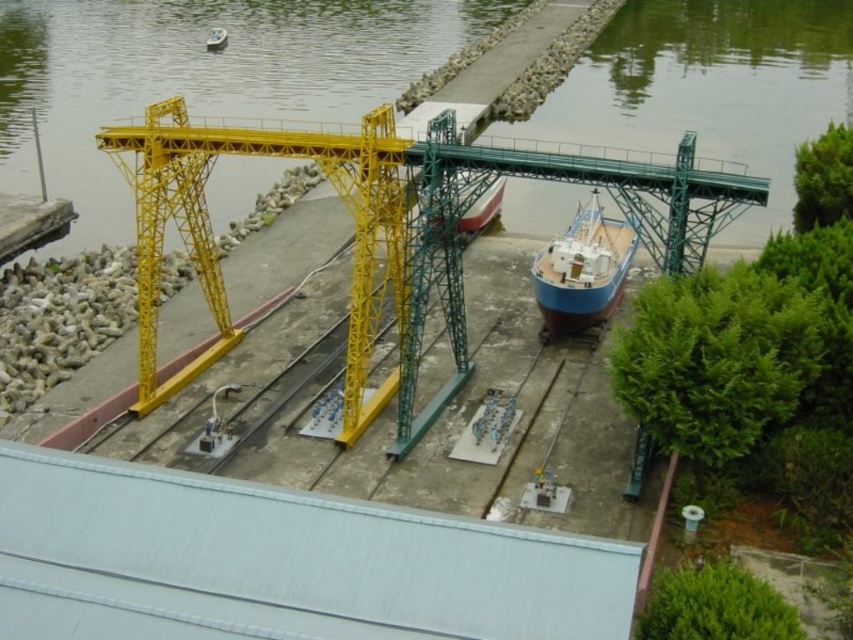
You are a model ship enthusiast who wants to place a new miniature lighthouse between the white matte dock at center and the blue matte boat at center in the shipyard model. Based on their sizes, which object should the lighthouse be closer to?

The white matte dock at center is shorter than the blue matte boat at center, so the lighthouse should be placed closer to the white matte dock at center to maintain proportional spacing between the objects.